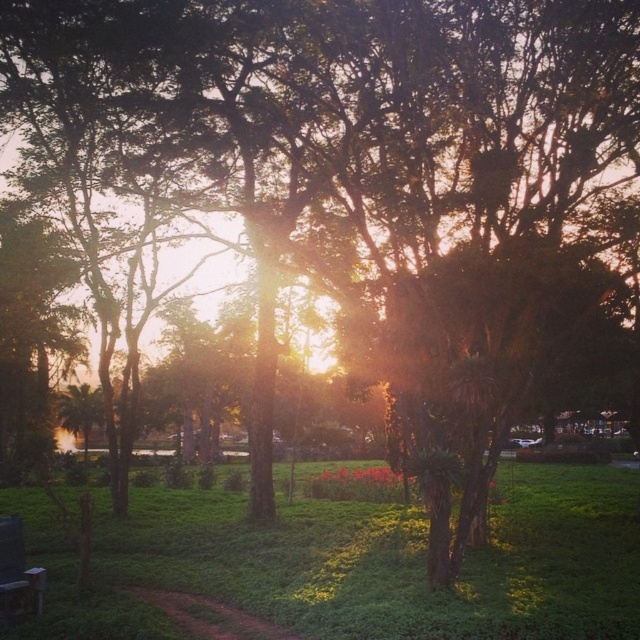
Question: Is green grassy at center to the right of wooden park bench at lower left from the viewer's perspective?

Choices:
 (A) no
 (B) yes

Answer: (B)

Question: Which point is closer to the camera?

Choices:
 (A) wooden park bench at lower left
 (B) green grassy at center

Answer: (B)

Question: From the image, what is the correct spatial relationship of green grassy at center in relation to wooden park bench at lower left?

Choices:
 (A) above
 (B) below

Answer: (B)

Question: From the image, what is the correct spatial relationship of green grassy at center in relation to wooden park bench at lower left?

Choices:
 (A) below
 (B) above

Answer: (A)